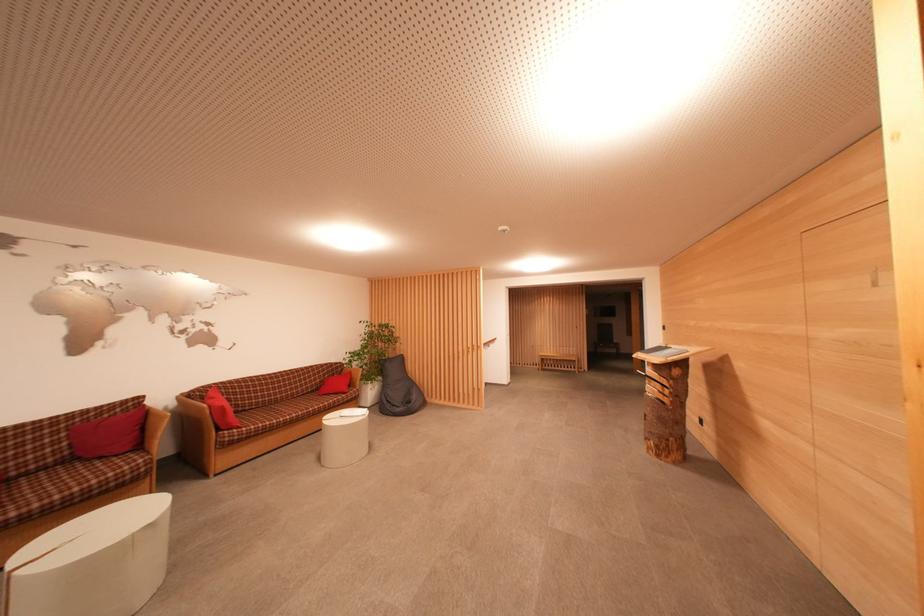
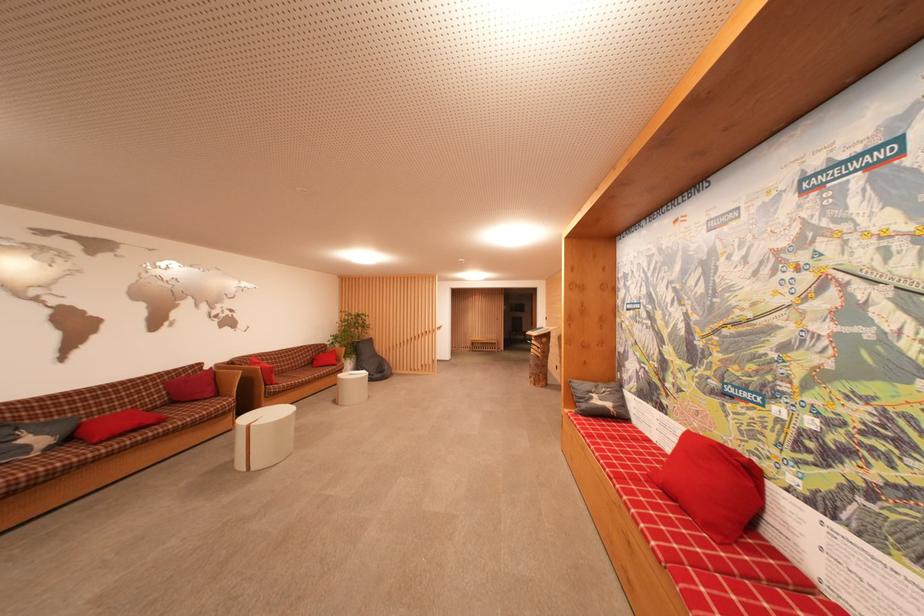
Where in the second image is the point corresponding to pixel 103 418 from the first image?

(183, 378)